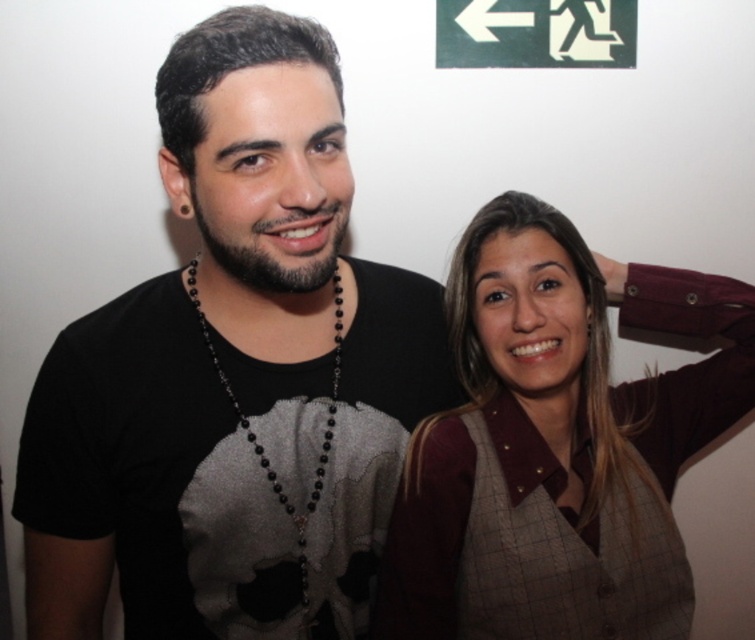
Question: Is black matte t-shirt at center to the right of plaid fabric vest at right from the viewer's perspective?

Choices:
 (A) yes
 (B) no

Answer: (B)

Question: Does black matte t-shirt at center have a smaller size compared to plaid fabric vest at right?

Choices:
 (A) no
 (B) yes

Answer: (B)

Question: Among these objects, which one is nearest to the camera?

Choices:
 (A) black matte t-shirt at center
 (B) plaid fabric vest at right

Answer: (A)

Question: Which point is closer to the camera taking this photo?

Choices:
 (A) (297, 525)
 (B) (414, 436)

Answer: (A)

Question: Does black matte t-shirt at center appear on the left side of plaid fabric vest at right?

Choices:
 (A) yes
 (B) no

Answer: (A)

Question: Which of the following is the farthest from the observer?

Choices:
 (A) black matte t-shirt at center
 (B) plaid fabric vest at right

Answer: (B)